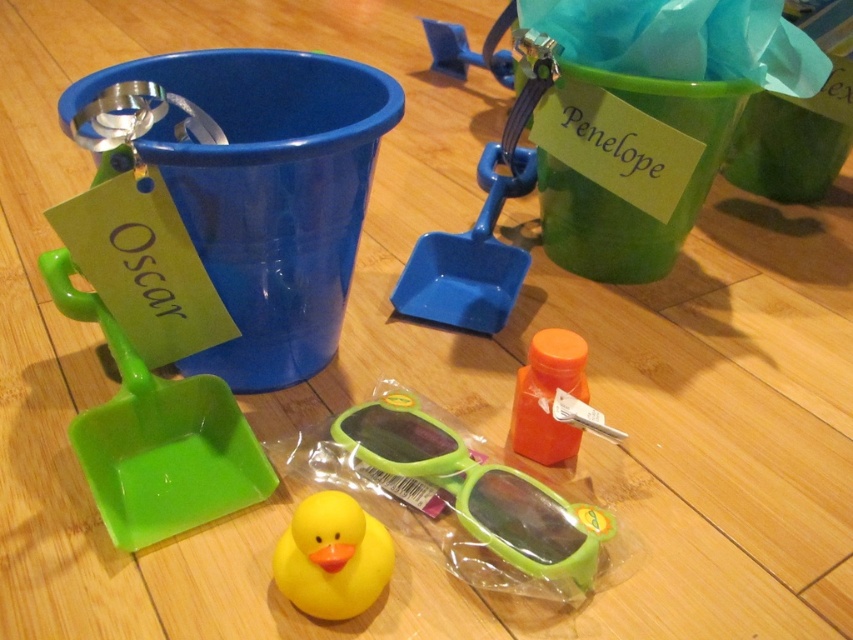
Question: Which object is the farthest from the blue plastic shovel at center?

Choices:
 (A) orange matte bottle at center
 (B) green plastic goggles at center
 (C) rubber duck at center

Answer: (C)

Question: Is green plastic goggles at center bigger than blue plastic shovel at center?

Choices:
 (A) yes
 (B) no

Answer: (B)

Question: Considering the real-world distances, which object is closest to the blue plastic shovel at center?

Choices:
 (A) green plastic goggles at center
 (B) orange matte bottle at center

Answer: (B)

Question: Does green plastic goggles at center appear under rubber duck at center?

Choices:
 (A) no
 (B) yes

Answer: (A)

Question: Is green plastic goggles at center above rubber duck at center?

Choices:
 (A) no
 (B) yes

Answer: (B)

Question: Among these objects, which one is nearest to the camera?

Choices:
 (A) blue plastic shovel at center
 (B) rubber duck at center

Answer: (B)